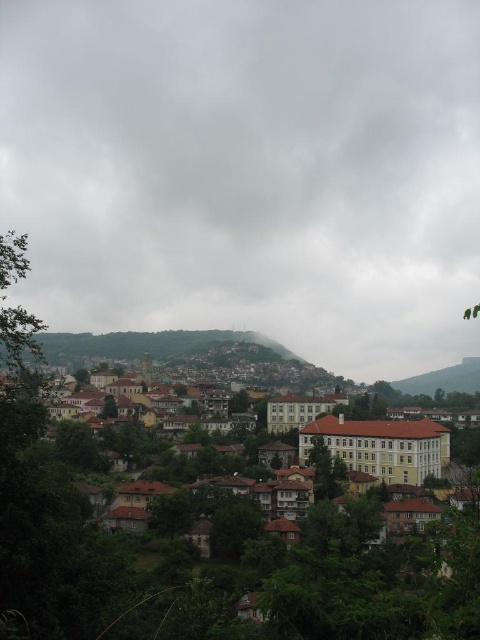
Which is in front, point (122, 196) or point (75, 634)?

Positioned in front is point (75, 634).

What do you see at coordinates (250, 172) in the screenshot?
I see `cloudy gray sky at upper center` at bounding box center [250, 172].

At what (x,y) coordinates should I click in order to perform the action: click on cloudy gray sky at upper center. Please return your answer as a coordinate pair (x, y). This screenshot has width=480, height=640. Looking at the image, I should click on coord(250,172).